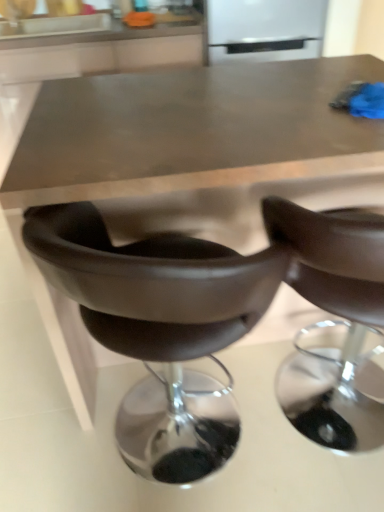
Where is `free spot above metallic brown table at center (from a real-world perspective)`? Image resolution: width=384 pixels, height=512 pixels. free spot above metallic brown table at center (from a real-world perspective) is located at coordinates (204, 105).